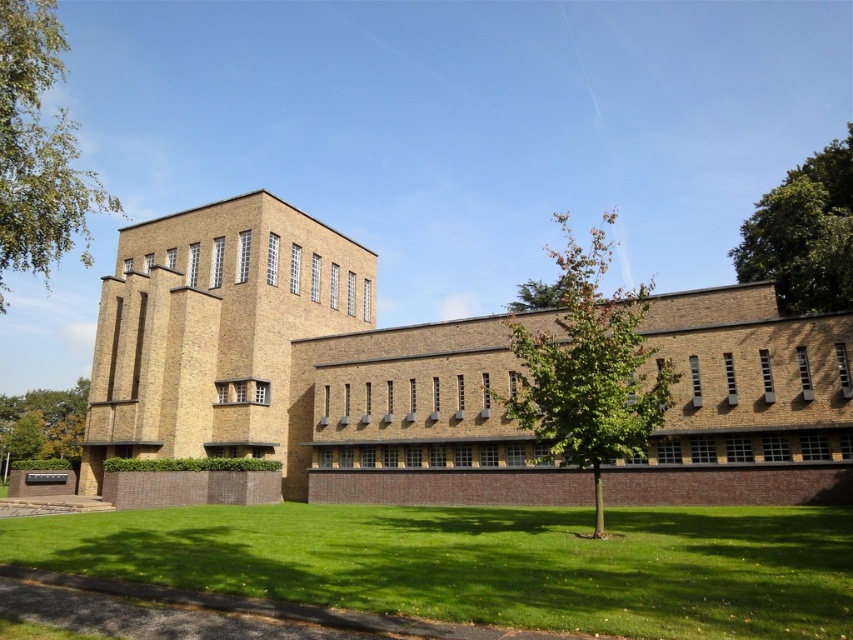
Is green leafy tree at center positioned behind green leafy tree at left?

No, green leafy tree at center is in front of green leafy tree at left.

The height and width of the screenshot is (640, 853). In order to click on green leafy tree at center in this screenshot , I will do `click(589, 369)`.

Is green grass at lower center shorter than green leafy tree at upper right?

Correct, green grass at lower center is not as tall as green leafy tree at upper right.

Is point (509, 515) positioned in front of point (755, 260)?

Yes, it is.

Which is behind, point (839, 595) or point (764, 232)?

The point (764, 232) is behind.

This screenshot has height=640, width=853. Find the location of `green grass at lower center`. green grass at lower center is located at coordinates (485, 563).

Is point (279, 556) behind point (0, 474)?

No.

Is green grass at lower center below green leafy tree at lower left?

No, green grass at lower center is not below green leafy tree at lower left.

Does point (345, 573) come in front of point (22, 401)?

Yes, it is in front of point (22, 401).

At what (x,y) coordinates should I click in order to perform the action: click on green grass at lower center. Please return your answer as a coordinate pair (x, y). The image size is (853, 640). Looking at the image, I should click on (485, 563).